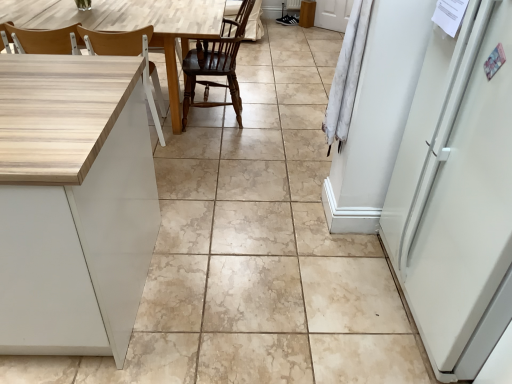
You are a GUI agent. You are given a task and a screenshot of the screen. Output one action in this format:
    pyautogui.click(x=<x>, y=<y>)
    Task: Click on the unoccupied region to the right of wooden at left, which appears as the second chair when viewed from the right
    The width and height of the screenshot is (512, 384).
    Given the screenshot: What is the action you would take?
    pyautogui.click(x=187, y=146)